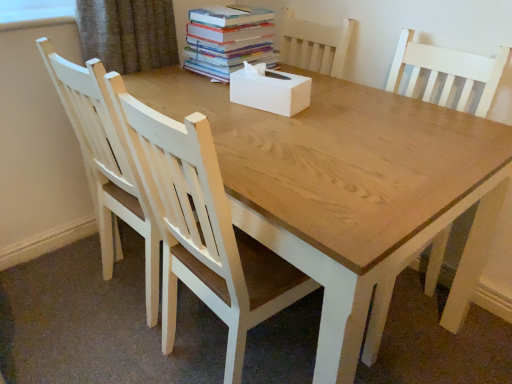
Where is `unoccupied area in front of white wood chair at left, which is the 1th chair from left to right`? The image size is (512, 384). unoccupied area in front of white wood chair at left, which is the 1th chair from left to right is located at coordinates (95, 349).